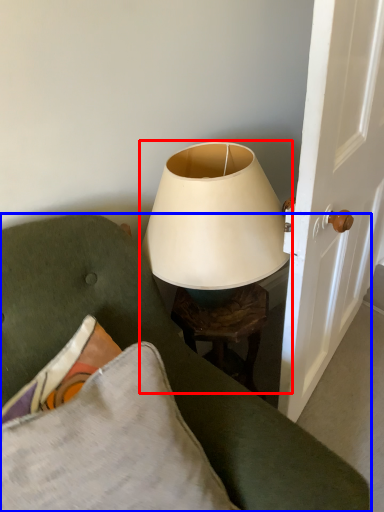
Question: Which of the following is the closest to the observer, lamp (highlighted by a red box) or furniture (highlighted by a blue box)?

Choices:
 (A) lamp
 (B) furniture

Answer: (B)